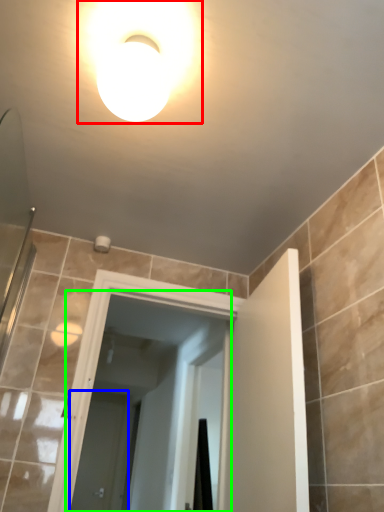
Question: Which object is positioned farthest from light fixture (highlighted by a red box)? Select from screen door (highlighted by a blue box) and screen door (highlighted by a green box).

Choices:
 (A) screen door
 (B) screen door

Answer: (A)